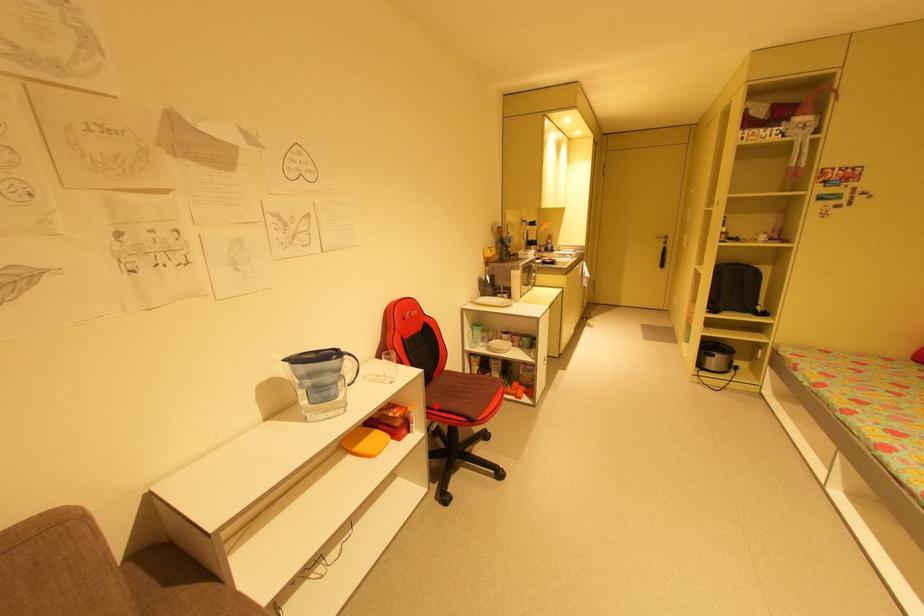
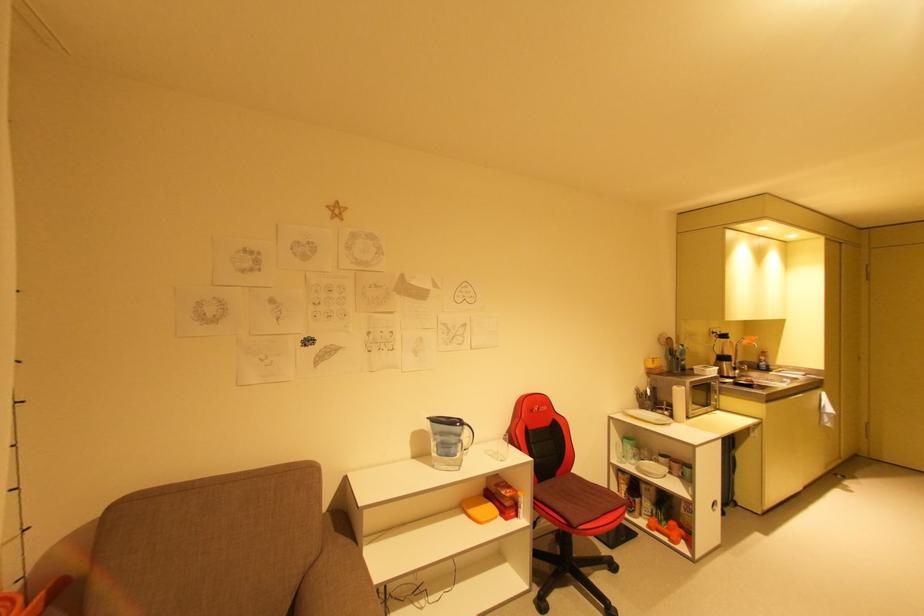
Locate, in the second image, the point that corresponds to the highlighted location in the first image.

(544, 498)